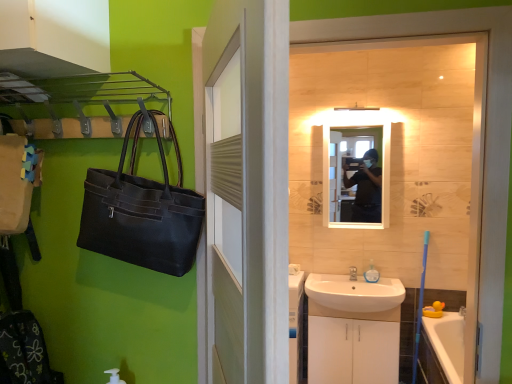
This screenshot has width=512, height=384. Identify the location of matte black mirror at center. (355, 176).

From a real-world perspective, is white glossy cabinet at lower center positioned under white wood door at center based on gravity?

Yes, from a real-world perspective, white glossy cabinet at lower center is under white wood door at center.

Considering the sizes of objects white glossy cabinet at lower center and white wood door at center in the image provided, who is shorter, white glossy cabinet at lower center or white wood door at center?

Standing shorter between the two is white glossy cabinet at lower center.

Locate an element on the screen. This screenshot has height=384, width=512. bathroom cabinet below the white wood door at center (from the image's perspective) is located at coordinates (353, 329).

What's the angular difference between white glossy cabinet at lower center and white wood door at center's facing directions?

113 degrees.

Could you tell me if matte black mirror at center is turned towards white wood door at center?

Yes, matte black mirror at center faces towards white wood door at center.

From the image's perspective, would you say matte black mirror at center is positioned over white wood door at center?

Yes, from the image's perspective, matte black mirror at center is on top of white wood door at center.

From a real-world perspective, is matte black mirror at center on top of white wood door at center?

Correct, in the physical world, matte black mirror at center is higher than white wood door at center.

Can you confirm if translucent plastic soap dispenser at sink is taller than matte black mirror at center?

No.

Is translucent plastic soap dispenser at sink facing away from matte black mirror at center?

That's not correct — translucent plastic soap dispenser at sink is not looking away from matte black mirror at center.

Are translucent plastic soap dispenser at sink and matte black mirror at center far apart?

translucent plastic soap dispenser at sink is near matte black mirror at center, not far away.

Does translucent plastic soap dispenser at sink have a lesser width compared to matte black mirror at center?

Correct, the width of translucent plastic soap dispenser at sink is less than that of matte black mirror at center.

Which is less distant, (372, 276) or (218, 68)?

The point (218, 68) is in front.

Would you say white wood door at center is part of translucent plastic soap dispenser at sink's contents?

No, white wood door at center is not surrounded by translucent plastic soap dispenser at sink.

Locate an element on the screen. The image size is (512, 384). toiletry below the white wood door at center (from a real-world perspective) is located at coordinates (371, 274).

Are white ceramic sink at lower center and silver metallic faucet at sink right beside each other?

No, white ceramic sink at lower center is not touching silver metallic faucet at sink right.

Based on their positions, is white ceramic sink at lower center located to the left or right of silver metallic faucet at sink right?

white ceramic sink at lower center is positioned on silver metallic faucet at sink right's left side.

Does white ceramic sink at lower center have a lesser width compared to silver metallic faucet at sink right?

No.

Considering the sizes of white ceramic sink at lower center and silver metallic faucet at sink right in the image, is white ceramic sink at lower center taller or shorter than silver metallic faucet at sink right?

In the image, white ceramic sink at lower center appears to be taller than silver metallic faucet at sink right.

From a real-world perspective, is silver metallic faucet at sink right physically above white glossy cabinet at lower center?

Yes.

Based on their positions, is silver metallic faucet at sink right located to the left or right of white glossy cabinet at lower center?

silver metallic faucet at sink right is positioned on white glossy cabinet at lower center's right side.

Which is behind, point (353, 276) or point (392, 369)?

The point (353, 276) is more distant.

Based on the photo, from the image's perspective, which is above, silver metallic faucet at sink right or matte black mirror at center?

matte black mirror at center is shown above in the image.

Between silver metallic faucet at sink right and matte black mirror at center, which one appears on the right side from the viewer's perspective?

matte black mirror at center.

Can you confirm if silver metallic faucet at sink right is wider than matte black mirror at center?

Yes, silver metallic faucet at sink right is wider than matte black mirror at center.

At what (x,y) coordinates should I click in order to perform the action: click on mirror in front of the silver metallic faucet at sink right. Please return your answer as a coordinate pair (x, y). Looking at the image, I should click on (355, 176).

The image size is (512, 384). In order to click on bathroom cabinet lying on the right of white wood door at center in this screenshot , I will do `click(353, 329)`.

Identify the location of door lying below the matte black mirror at center (from the image's perspective). The width and height of the screenshot is (512, 384). (249, 193).

Which object lies further to the anchor point translucent plastic soap dispenser at sink, white glossy cabinet at lower center or white ceramic sink at lower center?

Among the two, white glossy cabinet at lower center is located further to translucent plastic soap dispenser at sink.

Based on their spatial positions, is matte black mirror at center or white glossy cabinet at lower center further from white wood door at center?

matte black mirror at center is further to white wood door at center.

Based on the photo, which object lies nearer to the anchor point silver metallic faucet at sink right, white ceramic sink at lower center or white glossy cabinet at lower center?

Based on the image, white ceramic sink at lower center appears to be nearer to silver metallic faucet at sink right.

Estimate the real-world distances between objects in this image. Which object is closer to white ceramic sink at lower center, silver metallic faucet at sink right or white glossy cabinet at lower center?

white glossy cabinet at lower center lies closer to white ceramic sink at lower center than the other object.

Estimate the real-world distances between objects in this image. Which object is further from silver metallic faucet at sink right, translucent plastic soap dispenser at sink or white wood door at center?

white wood door at center lies further to silver metallic faucet at sink right than the other object.

Estimate the real-world distances between objects in this image. Which object is further from silver metallic faucet at sink right, white wood door at center or matte black mirror at center?

Based on the image, white wood door at center appears to be further to silver metallic faucet at sink right.

Estimate the real-world distances between objects in this image. Which object is further from white glossy cabinet at lower center, white wood door at center or white ceramic sink at lower center?

Based on the image, white wood door at center appears to be further to white glossy cabinet at lower center.

When comparing their distances from white ceramic sink at lower center, does matte black mirror at center or white wood door at center seem closer?

matte black mirror at center is positioned closer to the anchor white ceramic sink at lower center.

Find the location of a particular element. Image resolution: width=512 pixels, height=384 pixels. sink between white wood door at center and translucent plastic soap dispenser at sink from front to back is located at coordinates (354, 294).

Where is `tap between matte black mirror at center and white ceramic sink at lower center from top to bottom`? The image size is (512, 384). tap between matte black mirror at center and white ceramic sink at lower center from top to bottom is located at coordinates (353, 273).

Locate an element on the screen. The height and width of the screenshot is (384, 512). mirror between white wood door at center and silver metallic faucet at sink right from front to back is located at coordinates [355, 176].

Locate an element on the screen. The image size is (512, 384). bathroom cabinet between white wood door at center and silver metallic faucet at sink right in the front-back direction is located at coordinates (353, 329).